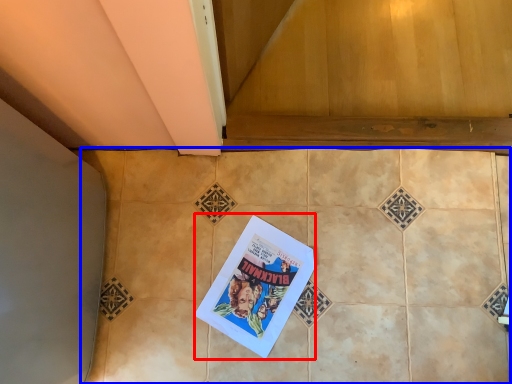
Question: Which of the following is the closest to the observer, comic book (highlighted by a red box) or ceramic tile (highlighted by a blue box)?

Choices:
 (A) comic book
 (B) ceramic tile

Answer: (B)